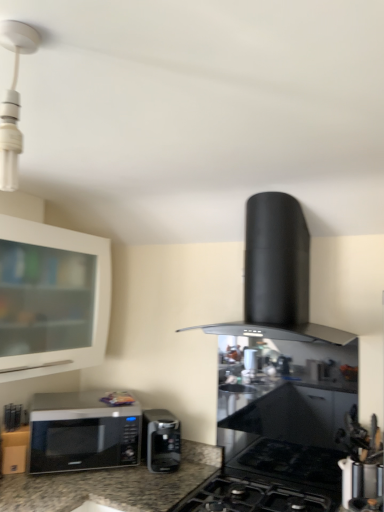
Locate an element on the screen. The width and height of the screenshot is (384, 512). satin black microwave at lower left, which appears as the first microwave oven when viewed from the right is located at coordinates (161, 440).

Measure the distance between point (84, 295) and camera.

Point (84, 295) is 2.34 meters away from camera.

This screenshot has width=384, height=512. What are the coordinates of `metallic silver utensil holder at lower right` in the screenshot? It's located at (361, 484).

I want to click on black matte gas stove at center, so click(x=270, y=481).

Is satin black microwave at lower left, which ranks as the 2th microwave oven in left-to-right order, placed right next to black matte range hood at center?

There is a gap between satin black microwave at lower left, which ranks as the 2th microwave oven in left-to-right order, and black matte range hood at center.

Considering the relative sizes of satin black microwave at lower left, which appears as the first microwave oven when viewed from the right, and black matte range hood at center in the image provided, is satin black microwave at lower left, which appears as the first microwave oven when viewed from the right, smaller than black matte range hood at center?

Indeed, satin black microwave at lower left, which appears as the first microwave oven when viewed from the right, has a smaller size compared to black matte range hood at center.

Considering the sizes of satin black microwave at lower left, which appears as the first microwave oven when viewed from the right, and black matte range hood at center in the image, is satin black microwave at lower left, which appears as the first microwave oven when viewed from the right, wider or thinner than black matte range hood at center?

Clearly, satin black microwave at lower left, which appears as the first microwave oven when viewed from the right, has less width compared to black matte range hood at center.

Is satin black microwave at lower left, which appears as the first microwave oven when viewed from the right, oriented away from black matte range hood at center?

satin black microwave at lower left, which appears as the first microwave oven when viewed from the right, does not have its back to black matte range hood at center.

Based on the photo, does metallic silver utensil holder at lower right have a greater height compared to white glossy cabinet at upper left?

No, metallic silver utensil holder at lower right is not taller than white glossy cabinet at upper left.

From a real-world perspective, is metallic silver utensil holder at lower right physically above white glossy cabinet at upper left?

No, from a real-world perspective, metallic silver utensil holder at lower right is not on top of white glossy cabinet at upper left.

Does metallic silver utensil holder at lower right come in front of white glossy cabinet at upper left?

Yes, it is.

Could you tell me if metallic silver utensil holder at lower right is turned towards white glossy cabinet at upper left?

No, metallic silver utensil holder at lower right does not turn towards white glossy cabinet at upper left.

How far apart are black matte gas stove at center and sleek black microwave at lower left, which is counted as the 2th microwave oven, starting from the right?

The distance of black matte gas stove at center from sleek black microwave at lower left, which is counted as the 2th microwave oven, starting from the right, is 24.69 inches.

From the image's perspective, is black matte gas stove at center on sleek black microwave at lower left, the 1th microwave oven viewed from the left?

No, from the image's perspective, black matte gas stove at center is not on top of sleek black microwave at lower left, the 1th microwave oven viewed from the left.

Can you see black matte gas stove at center touching sleek black microwave at lower left, which is counted as the 2th microwave oven, starting from the right?

No, black matte gas stove at center is not touching sleek black microwave at lower left, which is counted as the 2th microwave oven, starting from the right.

Considering the sizes of black matte gas stove at center and sleek black microwave at lower left, the 1th microwave oven viewed from the left, in the image, is black matte gas stove at center bigger or smaller than sleek black microwave at lower left, the 1th microwave oven viewed from the left,?

In the image, black matte gas stove at center appears to be larger than sleek black microwave at lower left, the 1th microwave oven viewed from the left.

Considering the sizes of objects black matte gas stove at center and black matte range hood at center in the image provided, who is shorter, black matte gas stove at center or black matte range hood at center?

black matte gas stove at center.

Looking at this image, who is smaller, black matte gas stove at center or black matte range hood at center?

With smaller size is black matte gas stove at center.

Which is more to the left, black matte gas stove at center or black matte range hood at center?

From the viewer's perspective, black matte gas stove at center appears more on the left side.

Which of these two, black matte range hood at center or sleek black microwave at lower left, which is counted as the 2th microwave oven, starting from the right, stands shorter?

sleek black microwave at lower left, which is counted as the 2th microwave oven, starting from the right.

From the image's perspective, does black matte range hood at center appear higher than sleek black microwave at lower left, the 1th microwave oven viewed from the left?

Yes, from the image's perspective, black matte range hood at center is above sleek black microwave at lower left, the 1th microwave oven viewed from the left.

Is black matte range hood at center spatially inside sleek black microwave at lower left, the 1th microwave oven viewed from the left, or outside of it?

black matte range hood at center is spatially situated outside sleek black microwave at lower left, the 1th microwave oven viewed from the left.

Is point (144, 451) farther from camera compared to point (43, 232)?

Yes, point (144, 451) is behind point (43, 232).

Can you confirm if satin black microwave at lower left, which ranks as the 2th microwave oven in left-to-right order, is bigger than white glossy cabinet at upper left?

Actually, satin black microwave at lower left, which ranks as the 2th microwave oven in left-to-right order, might be smaller than white glossy cabinet at upper left.

In the image, is satin black microwave at lower left, which ranks as the 2th microwave oven in left-to-right order, positioned in front of or behind white glossy cabinet at upper left?

satin black microwave at lower left, which ranks as the 2th microwave oven in left-to-right order, is positioned farther from the viewer than white glossy cabinet at upper left.

Is satin black microwave at lower left, which appears as the first microwave oven when viewed from the right, placed right next to white glossy cabinet at upper left?

No.

Considering the relative positions of black matte range hood at center and black matte gas stove at center in the image provided, is black matte range hood at center to the right of black matte gas stove at center from the viewer's perspective?

Yes, black matte range hood at center is to the right of black matte gas stove at center.

Does black matte range hood at center have a larger size compared to black matte gas stove at center?

Yes.

Is black matte range hood at center turned away from black matte gas stove at center?

No, black matte gas stove at center is not at the back of black matte range hood at center.

I want to click on the 1st microwave oven counting from the left of the black matte range hood at center, so click(161, 440).

Locate an element on the screen. appliance that appears below the white glossy cabinet at upper left (from the image's perspective) is located at coordinates [361, 484].

Looking at the image, which one is located further to white glossy cabinet at upper left, black matte range hood at center or black matte gas stove at center?

black matte gas stove at center is further to white glossy cabinet at upper left.

When comparing their distances from black matte range hood at center, does satin black microwave at lower left, which appears as the first microwave oven when viewed from the right, or black matte gas stove at center seem closer?

Among the two, black matte gas stove at center is located nearer to black matte range hood at center.

When comparing their distances from black matte gas stove at center, does white glossy light fixture at upper left or black matte range hood at center seem further?

white glossy light fixture at upper left is positioned further to the anchor black matte gas stove at center.

From the image, which object appears to be nearer to sleek black microwave at lower left, the 1th microwave oven viewed from the left, white glossy cabinet at upper left or white glossy light fixture at upper left?

The object closer to sleek black microwave at lower left, the 1th microwave oven viewed from the left, is white glossy cabinet at upper left.

When comparing their distances from sleek black microwave at lower left, the 1th microwave oven viewed from the left, does metallic silver utensil holder at lower right or black matte gas stove at center seem closer?

black matte gas stove at center is positioned closer to the anchor sleek black microwave at lower left, the 1th microwave oven viewed from the left.

Looking at the image, which one is located further to sleek black microwave at lower left, the 1th microwave oven viewed from the left, satin black microwave at lower left, which ranks as the 2th microwave oven in left-to-right order, or black matte gas stove at center?

Among the two, black matte gas stove at center is located further to sleek black microwave at lower left, the 1th microwave oven viewed from the left.

Based on their spatial positions, is metallic silver utensil holder at lower right or black matte range hood at center further from white glossy cabinet at upper left?

The object further to white glossy cabinet at upper left is metallic silver utensil holder at lower right.

Estimate the real-world distances between objects in this image. Which object is closer to white glossy light fixture at upper left, sleek black microwave at lower left, which is counted as the 2th microwave oven, starting from the right, or metallic silver utensil holder at lower right?

sleek black microwave at lower left, which is counted as the 2th microwave oven, starting from the right, is closer to white glossy light fixture at upper left.

You are a GUI agent. You are given a task and a screenshot of the screen. Output one action in this format:
    pyautogui.click(x=<x>, y=<y>)
    Task: Click on the light fixture between white glossy cabinet at upper left and metallic silver utensil holder at lower right from left to right
    
    Given the screenshot: What is the action you would take?
    (x=13, y=101)

Image resolution: width=384 pixels, height=512 pixels. In order to click on kitchen appliance between white glossy light fixture at upper left and metallic silver utensil holder at lower right in the vertical direction in this screenshot , I will do `click(277, 276)`.

Identify the location of cabinetry between white glossy light fixture at upper left and black matte gas stove at center in the up-down direction. (66, 295).

The height and width of the screenshot is (512, 384). Identify the location of microwave oven situated between sleek black microwave at lower left, which is counted as the 2th microwave oven, starting from the right, and metallic silver utensil holder at lower right from left to right. (161, 440).